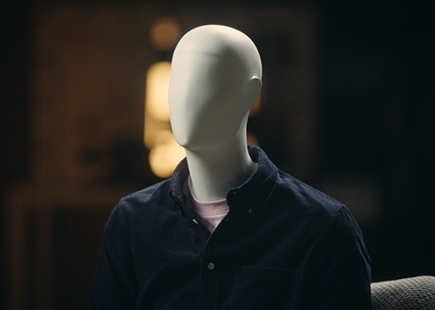
The image size is (435, 310). What are the coordinates of `sofa cushion` in the screenshot? It's located at (396, 292).